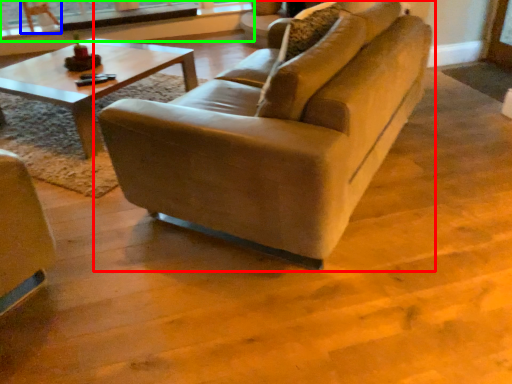
Question: Considering the real-world distances, which object is farthest from studio couch (highlighted by a red box)? armchair (highlighted by a blue box) or window frame (highlighted by a green box)?

Choices:
 (A) armchair
 (B) window frame

Answer: (A)